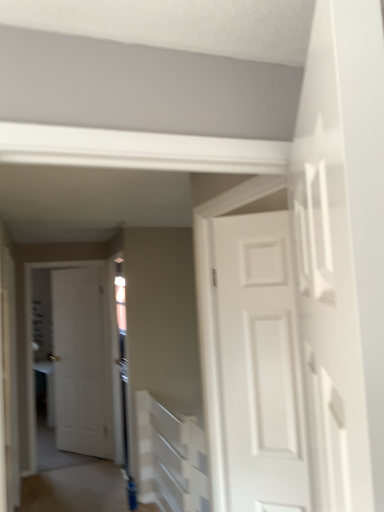
In order to face blue glossy door at lower center, should I rotate leftwards or rightwards?

Rotate left and turn 12.858 degrees.

Where is `white matte door at center, the first door positioned from the left`? white matte door at center, the first door positioned from the left is located at coordinates (81, 362).

Considering the sizes of white matte door at center, the second door when ordered from right to left, and blue glossy door at lower center in the image, is white matte door at center, the second door when ordered from right to left, bigger or smaller than blue glossy door at lower center?

white matte door at center, the second door when ordered from right to left, is smaller than blue glossy door at lower center.

Is white matte door at center, acting as the 1th door starting from the back, outside of blue glossy door at lower center?

Indeed, white matte door at center, acting as the 1th door starting from the back, is completely outside blue glossy door at lower center.

Which object is thinner, white matte door at center, acting as the 1th door starting from the back, or blue glossy door at lower center?

white matte door at center, acting as the 1th door starting from the back, is thinner.

Between white matte door at center, acting as the 1th door starting from the back, and blue glossy door at lower center, which one appears on the left side from the viewer's perspective?

Positioned to the left is white matte door at center, acting as the 1th door starting from the back.

Considering the points (191, 499) and (46, 499), which point is behind, point (191, 499) or point (46, 499)?

The point (46, 499) is farther from the camera.

Do you think white textured stairwell at center is within blue glossy door at lower center, or outside of it?

The correct answer is: outside.

Can you see white textured stairwell at center touching blue glossy door at lower center?

No.

In the image, there is a white textured stairwell at center. In order to click on path below it (from the image's perspective) in this screenshot , I will do `click(76, 489)`.

The height and width of the screenshot is (512, 384). I want to click on door that appears below the white matte door at center, which is the 2th door from back to front (from a real-world perspective), so click(x=81, y=362).

From the picture: Is white matte door at center, which appears as the second door when viewed from the front, thinner than white matte door at center, which is the 1th door from right to left?

Incorrect, the width of white matte door at center, which appears as the second door when viewed from the front, is not less than that of white matte door at center, which is the 1th door from right to left.

From a real-world perspective, between white matte door at center, which appears as the second door when viewed from the front, and white matte door at center, which is the 1th door from right to left, who is vertically higher?

From a 3D spatial view, white matte door at center, which is the 1th door from right to left, is above.

Is point (30, 488) closer to camera compared to point (96, 377)?

Yes, point (30, 488) is closer to viewer.

Considering the relative sizes of blue glossy door at lower center and white matte door at center, the second door when ordered from right to left, in the image provided, is blue glossy door at lower center shorter than white matte door at center, the second door when ordered from right to left,?

Yes, blue glossy door at lower center is shorter than white matte door at center, the second door when ordered from right to left.

How many degrees apart are the facing directions of blue glossy door at lower center and white matte door at center, the second door when ordered from right to left?

The angular difference between blue glossy door at lower center and white matte door at center, the second door when ordered from right to left, is 12.6 degrees.

From a real-world perspective, is white matte door at center, which is the 1th door from right to left, physically above white textured stairwell at center?

→ Indeed, from a real-world perspective, white matte door at center, which is the 1th door from right to left, stands above white textured stairwell at center.

Is white matte door at center, which is the 2th door from back to front, closer to the viewer compared to white textured stairwell at center?

Yes, white matte door at center, which is the 2th door from back to front, is closer to the viewer.

Could you tell me if white matte door at center, the 1th door positioned from the front, is facing white textured stairwell at center?

No, white matte door at center, the 1th door positioned from the front, is not facing towards white textured stairwell at center.

Between white matte door at center, the 2th door in the left-to-right sequence, and white textured stairwell at center, which one has larger width?

white textured stairwell at center.

Is white textured stairwell at center placed right next to white matte door at center, which is the 1th door from right to left?

No, white textured stairwell at center is not in contact with white matte door at center, which is the 1th door from right to left.

Looking at this image, does white textured stairwell at center appear on the left side of white matte door at center, the 1th door positioned from the front?

Yes.

Is white matte door at center, which is the 1th door from right to left, completely or partially inside white textured stairwell at center?

That's incorrect, white matte door at center, which is the 1th door from right to left, is not inside white textured stairwell at center.

Which is in front, point (273, 410) or point (99, 503)?

The point (273, 410) is in front.

Which object is closer to the camera, white matte door at center, which is the 2th door from back to front, or blue glossy door at lower center?

Positioned in front is white matte door at center, which is the 2th door from back to front.

Which of these two, white matte door at center, which is the 1th door from right to left, or blue glossy door at lower center, stands shorter?

blue glossy door at lower center is shorter.

There is a blue glossy door at lower center. Where is `the 1st door above it (from a real-world perspective)`? The image size is (384, 512). the 1st door above it (from a real-world perspective) is located at coordinates (81, 362).

You are a GUI agent. You are given a task and a screenshot of the screen. Output one action in this format:
    pyautogui.click(x=<x>, y=<y>)
    Task: Click on the path lying below the white textured stairwell at center (from the image's perspective)
    
    Given the screenshot: What is the action you would take?
    coord(76,489)

Based on their spatial positions, is white matte door at center, which appears as the second door when viewed from the front, or white textured stairwell at center further from blue glossy door at lower center?

Among the two, white matte door at center, which appears as the second door when viewed from the front, is located further to blue glossy door at lower center.

Looking at the image, which one is located closer to blue glossy door at lower center, white matte door at center, which appears as the second door when viewed from the front, or white matte door at center, which is the 2th door from back to front?

Based on the image, white matte door at center, which appears as the second door when viewed from the front, appears to be nearer to blue glossy door at lower center.

Which object lies nearer to the anchor point white textured stairwell at center, blue glossy door at lower center or white matte door at center, the 2th door in the left-to-right sequence?

blue glossy door at lower center is closer to white textured stairwell at center.

Based on their spatial positions, is blue glossy door at lower center or white textured stairwell at center further from white matte door at center, which is the 1th door from right to left?

blue glossy door at lower center is positioned further to the anchor white matte door at center, which is the 1th door from right to left.

When comparing their distances from white matte door at center, acting as the 1th door starting from the back, does white matte door at center, which is the 2th door from back to front, or blue glossy door at lower center seem closer?

blue glossy door at lower center.

From the image, which object appears to be farther from white matte door at center, the first door positioned from the left, white matte door at center, which is the 1th door from right to left, or white textured stairwell at center?

white matte door at center, which is the 1th door from right to left, lies further to white matte door at center, the first door positioned from the left, than the other object.

Consider the image. Which object lies nearer to the anchor point white textured stairwell at center, white matte door at center, the second door when ordered from right to left, or white matte door at center, which is the 1th door from right to left?

white matte door at center, which is the 1th door from right to left, is positioned closer to the anchor white textured stairwell at center.

From the image, which object appears to be farther from white matte door at center, the second door when ordered from right to left, white textured stairwell at center or blue glossy door at lower center?

white textured stairwell at center is positioned further to the anchor white matte door at center, the second door when ordered from right to left.

In order to click on stairwell between white matte door at center, the 2th door in the left-to-right sequence, and white matte door at center, which appears as the second door when viewed from the front, along the z-axis in this screenshot , I will do pyautogui.click(x=170, y=458).

Image resolution: width=384 pixels, height=512 pixels. In order to click on path between white textured stairwell at center and white matte door at center, acting as the 1th door starting from the back, in the front-back direction in this screenshot , I will do pyautogui.click(x=76, y=489).

You are a GUI agent. You are given a task and a screenshot of the screen. Output one action in this format:
    pyautogui.click(x=<x>, y=<y>)
    Task: Click on the stairwell between white matte door at center, which is the 2th door from back to front, and blue glossy door at lower center, in the vertical direction
    The width and height of the screenshot is (384, 512).
    Given the screenshot: What is the action you would take?
    pyautogui.click(x=170, y=458)

Where is `path between white matte door at center, the 2th door in the left-to-right sequence, and white matte door at center, the second door when ordered from right to left, along the z-axis`? This screenshot has width=384, height=512. path between white matte door at center, the 2th door in the left-to-right sequence, and white matte door at center, the second door when ordered from right to left, along the z-axis is located at coordinates (76, 489).